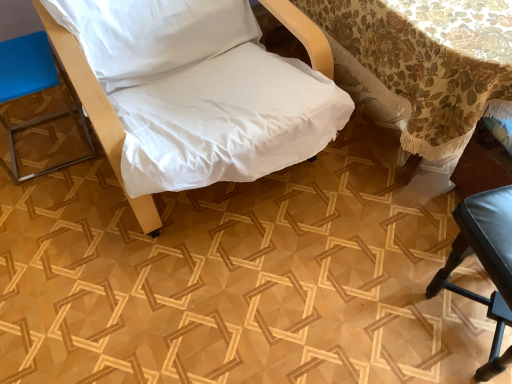
Locate an element on the screen. Image resolution: width=512 pixels, height=384 pixels. vacant area that lies between blue leather stool at left, the 1th furniture when ordered from left to right, and white fabric chair at center, which is counted as the second furniture, starting from the right is located at coordinates (81, 196).